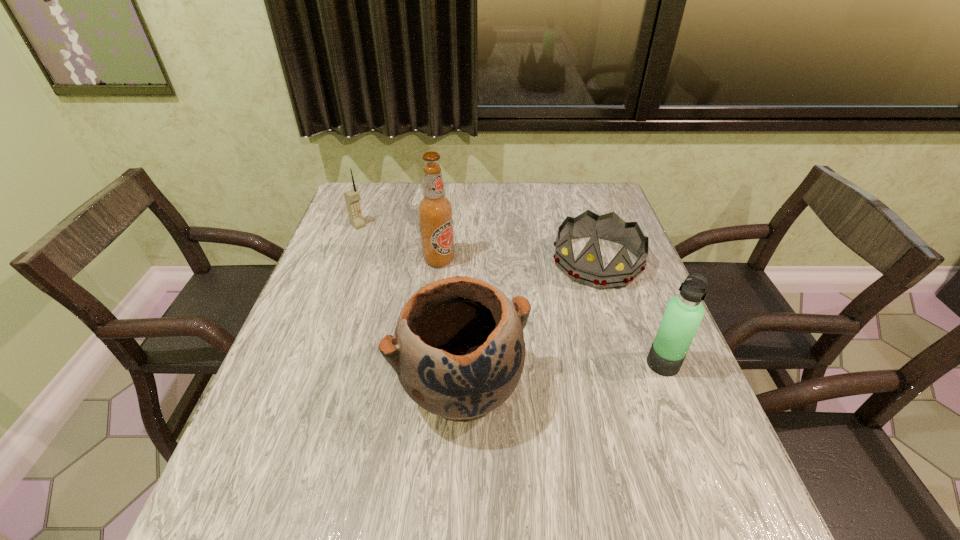
The height and width of the screenshot is (540, 960). Find the location of `thermos bottle at the right edge`. thermos bottle at the right edge is located at coordinates (683, 315).

The width and height of the screenshot is (960, 540). I want to click on tiara that is positioned at the right edge, so click(x=588, y=269).

Identify the location of object that is at the far left corner. (352, 197).

In the image, there is a desktop. Where is `vacant space at the far edge`? vacant space at the far edge is located at coordinates (422, 198).

Locate an element on the screen. This screenshot has height=540, width=960. free space at the near edge of the desktop is located at coordinates (489, 445).

This screenshot has width=960, height=540. What are the coordinates of `free region at the left edge of the desktop` in the screenshot? It's located at (352, 325).

This screenshot has width=960, height=540. Identify the location of free space at the right edge. 668,410.

The image size is (960, 540). I want to click on free location at the far right corner, so click(x=565, y=184).

Where is `empty space that is in between the thermos bottle and the pottery`? The height and width of the screenshot is (540, 960). empty space that is in between the thermos bottle and the pottery is located at coordinates (562, 375).

Locate an element on the screen. vacant space that is in between the tiara and the tallest object is located at coordinates (518, 260).